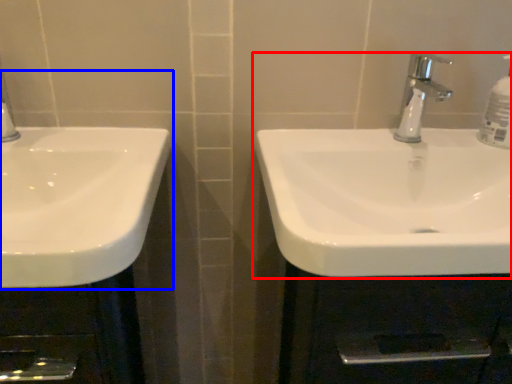
Question: Which point is closer to the camera, sink (highlighted by a red box) or sink (highlighted by a blue box)?

Choices:
 (A) sink
 (B) sink

Answer: (B)